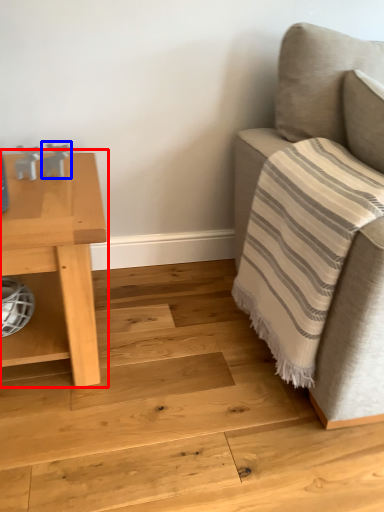
Question: Among these objects, which one is nearest to the camera, table (highlighted by a red box) or toy (highlighted by a blue box)?

Choices:
 (A) table
 (B) toy

Answer: (A)